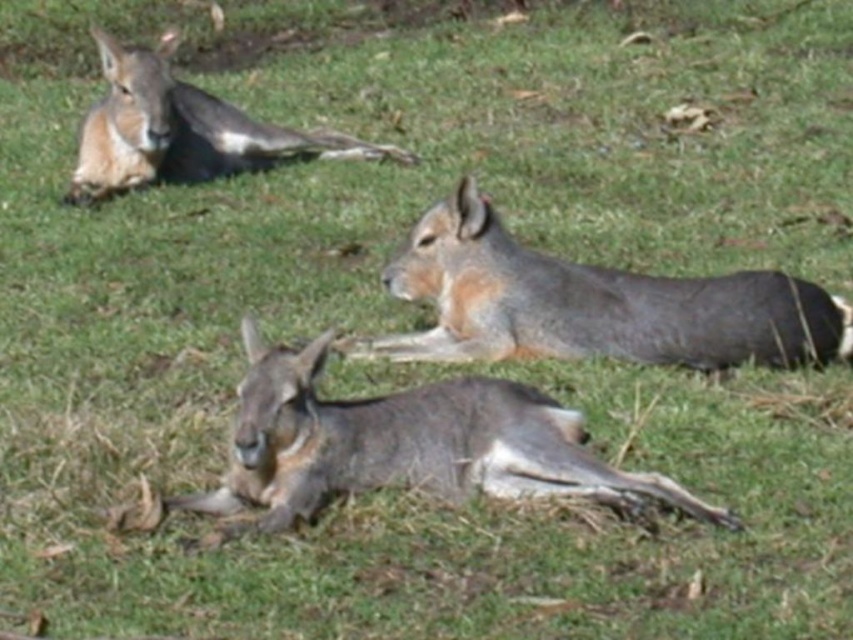
You are a wildlife photographer trying to capture a closeup shot of the gray fur kangaroo at lower center and the gray fur kangaroo at upper left. Which kangaroo will require you to use a wider angle lens to fit into the frame?

The gray fur kangaroo at upper left requires a wider angle lens because it occupies more space than the gray fur kangaroo at lower center.